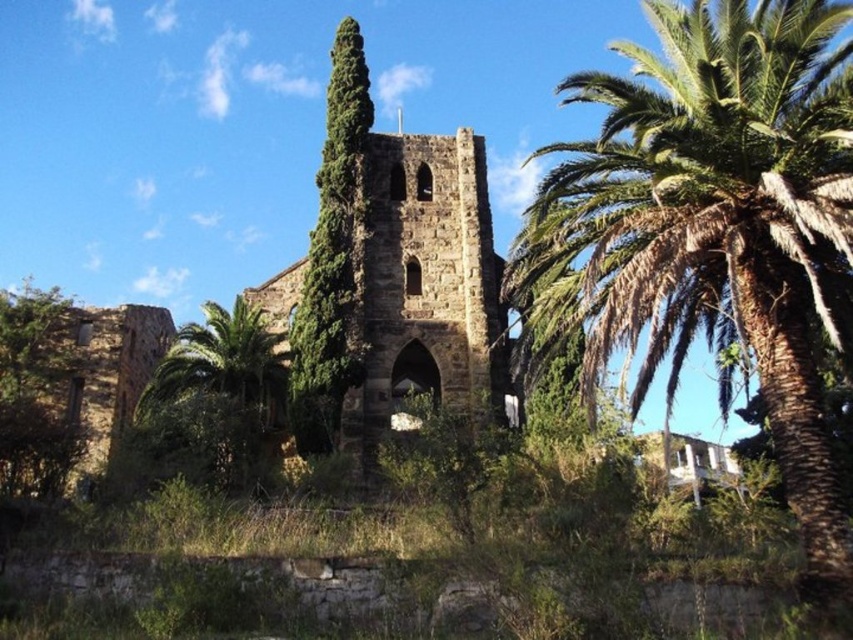
Question: Is green leafy palm tree at right to the left of green leafy tree at left from the viewer's perspective?

Choices:
 (A) yes
 (B) no

Answer: (B)

Question: Based on their relative distances, which object is farther from the green leafy palm tree at center?

Choices:
 (A) brown stone church at center
 (B) green leafy palm tree at right
 (C) green leafy tree at left

Answer: (B)

Question: Is green leafy palm tree at right positioned before brown stone church at center?

Choices:
 (A) yes
 (B) no

Answer: (A)

Question: Considering the relative positions of green leafy tree at center and green leafy palm tree at center in the image provided, where is green leafy tree at center located with respect to green leafy palm tree at center?

Choices:
 (A) above
 (B) below

Answer: (A)

Question: Estimate the real-world distances between objects in this image. Which object is farther from the green leafy palm tree at center?

Choices:
 (A) green leafy palm tree at right
 (B) brown stone church at center
 (C) green leafy tree at left
 (D) green leafy tree at center

Answer: (A)

Question: Based on their relative distances, which object is nearer to the green leafy tree at center?

Choices:
 (A) green leafy palm tree at center
 (B) green leafy tree at left
 (C) brown stone church at center

Answer: (C)